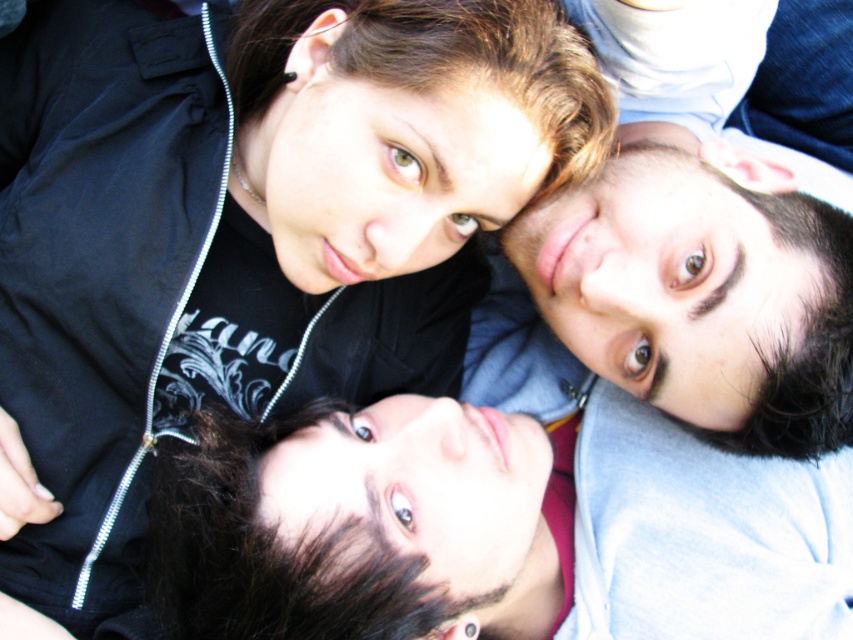
Question: Does smooth skin face at center have a larger size compared to smooth skin face at upper right?

Choices:
 (A) yes
 (B) no

Answer: (B)

Question: Does black matte jacket at upper left appear under smooth skin face at upper right?

Choices:
 (A) no
 (B) yes

Answer: (B)

Question: Which of these objects is positioned closest to the smooth skin face at center?

Choices:
 (A) smooth skin face at upper right
 (B) black matte jacket at upper left

Answer: (B)

Question: Which of the following is the closest to the observer?

Choices:
 (A) smooth skin face at upper right
 (B) black matte jacket at upper left

Answer: (B)

Question: Which point is closer to the camera?

Choices:
 (A) smooth skin face at upper right
 (B) smooth skin face at center

Answer: (A)

Question: Can you confirm if black matte jacket at upper left is thinner than smooth skin face at upper right?

Choices:
 (A) no
 (B) yes

Answer: (A)